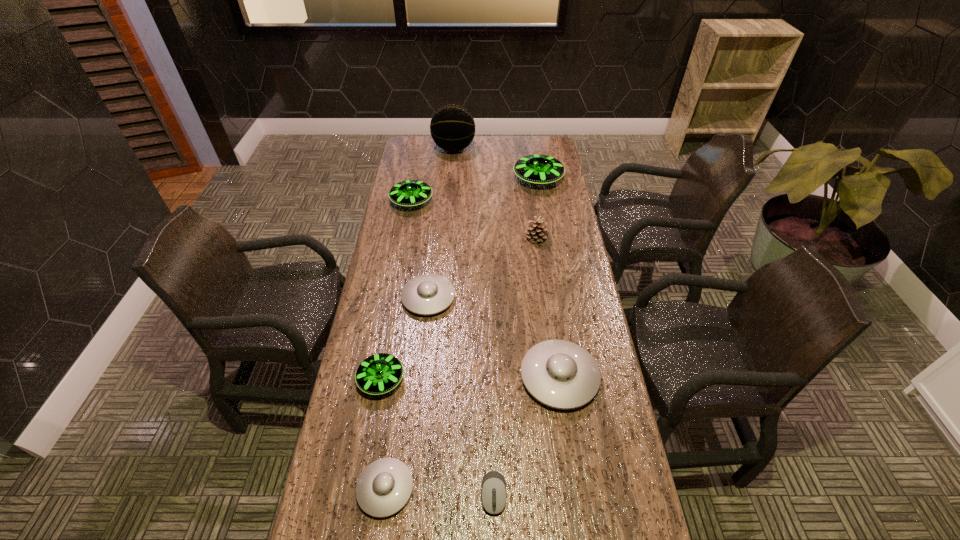
The width and height of the screenshot is (960, 540). Identify the location of the second smallest gray saucer. (428, 294).

Identify the location of the fifth nearest object. This screenshot has width=960, height=540. (428, 294).

This screenshot has height=540, width=960. Find the location of `the smallest gray saucer`. the smallest gray saucer is located at coordinates (384, 487).

At what (x,y) coordinates should I click in order to perform the action: click on the shortest saucer. Please return your answer as a coordinate pair (x, y). Looking at the image, I should click on (384, 487).

Where is `computer equipment`? The image size is (960, 540). computer equipment is located at coordinates (493, 489).

You are a GUI agent. You are given a task and a screenshot of the screen. Output one action in this format:
    pyautogui.click(x=<x>, y=<y>)
    Task: Click on the shortest object
    This screenshot has height=540, width=960.
    Given the screenshot: What is the action you would take?
    pyautogui.click(x=493, y=489)

Identify the location of vacant area situated on the right of the basketball. The image size is (960, 540). (551, 148).

This screenshot has width=960, height=540. Find the location of `vacant space situated on the front of the biggest green saucer`. vacant space situated on the front of the biggest green saucer is located at coordinates (550, 253).

The image size is (960, 540). Identify the location of vacant space located 0.100m on the back of the pinecone. (534, 214).

Where is `vacant space located 0.130m on the back of the second smallest green saucer`? This screenshot has width=960, height=540. vacant space located 0.130m on the back of the second smallest green saucer is located at coordinates (417, 173).